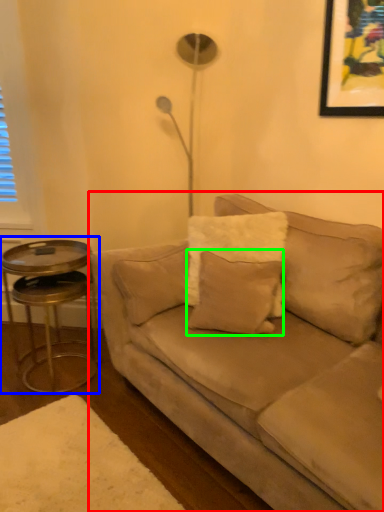
Question: Estimate the real-world distances between objects in this image. Which object is farther from studio couch (highlighted by a red box), table (highlighted by a blue box) or pillow (highlighted by a green box)?

Choices:
 (A) table
 (B) pillow

Answer: (A)